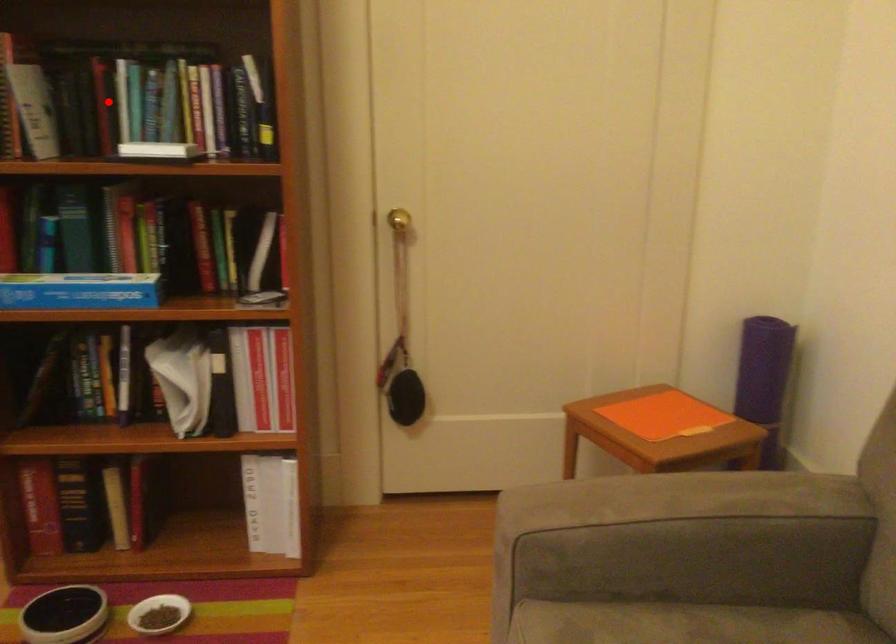
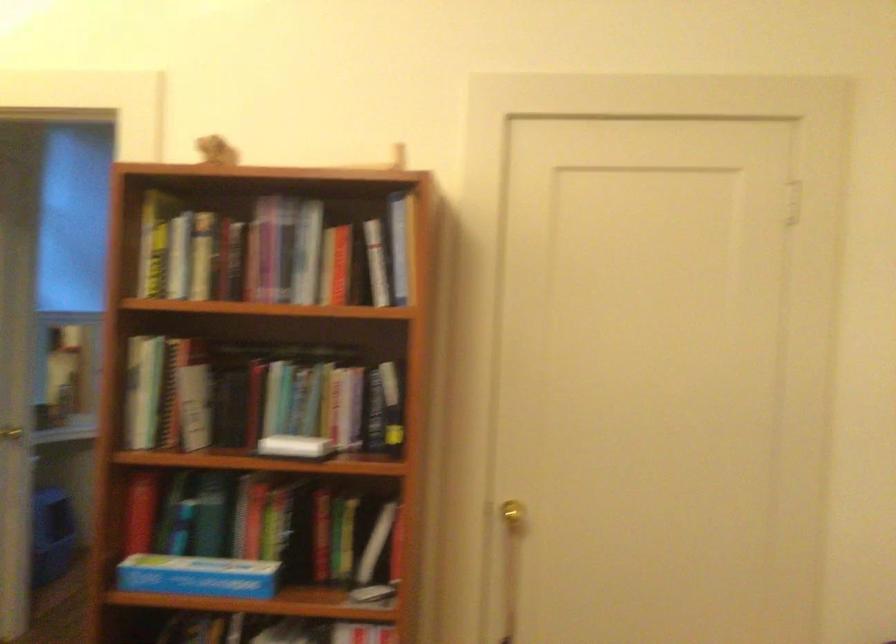
The point at the highlighted location is marked in the first image. Where is the corresponding point in the second image?

(255, 400)